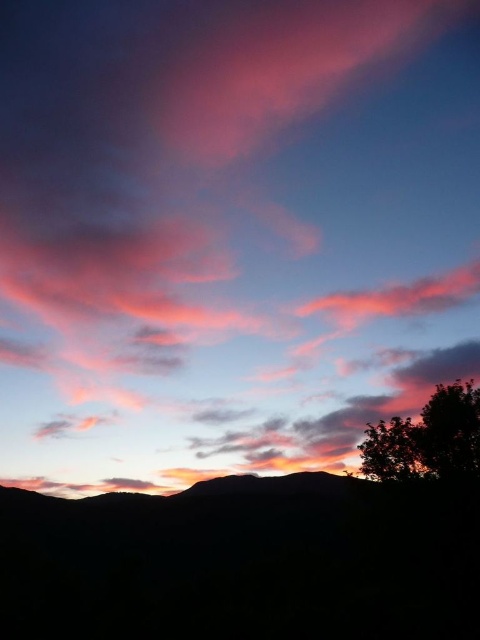
Is point (119, 557) farther from viewer compared to point (423, 444)?

Yes.

Between point (462, 616) and point (463, 458), which one is positioned behind?

The point (463, 458) is more distant.

The height and width of the screenshot is (640, 480). Find the location of `silhouette mountain at center`. silhouette mountain at center is located at coordinates (242, 563).